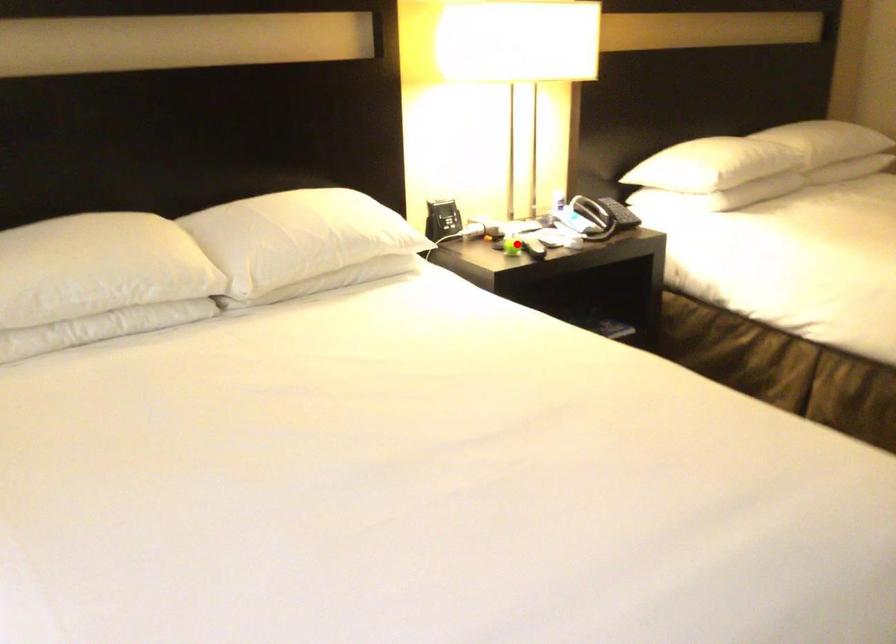
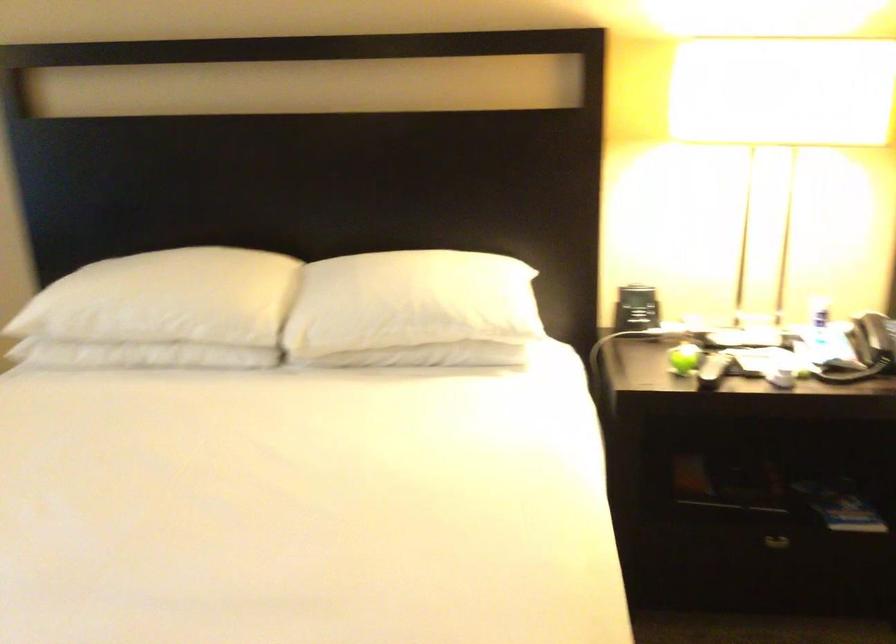
Question: A red point is marked in image1. In image2, is the corresponding 3D point closer to the camera or farther? Reply with the corresponding letter.

Choices:
 (A) The corresponding 3D point is closer.
 (B) The corresponding 3D point is farther.

Answer: (A)